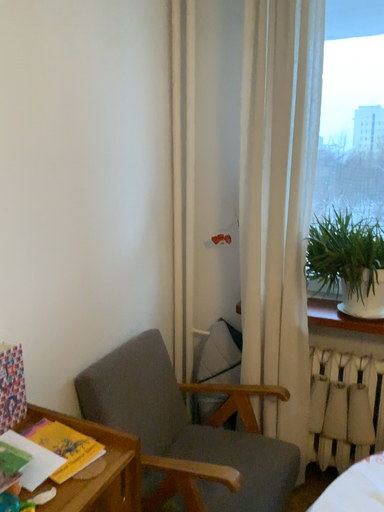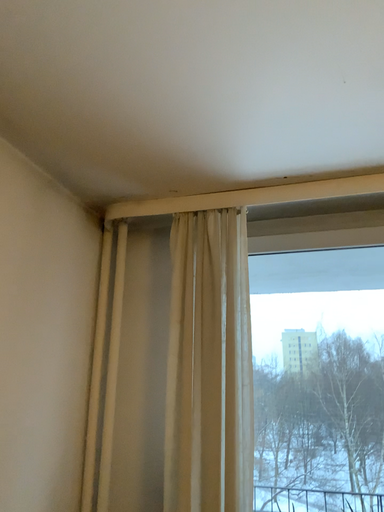
Question: Which way did the camera rotate in the video?

Choices:
 (A) rotated left
 (B) rotated right

Answer: (B)